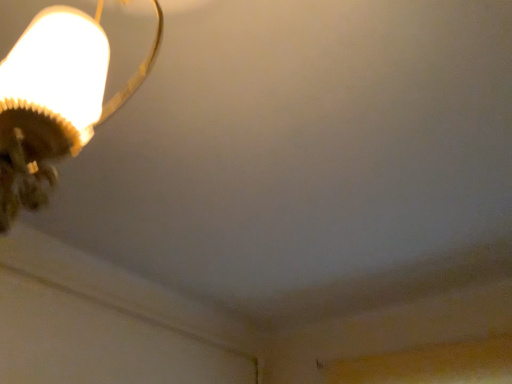
The width and height of the screenshot is (512, 384). Find the location of `matte gold lamp at upper left`. matte gold lamp at upper left is located at coordinates (54, 101).

Describe the element at coordinates (54, 101) in the screenshot. I see `matte gold lamp at upper left` at that location.

This screenshot has width=512, height=384. I want to click on matte gold lamp at upper left, so click(x=54, y=101).